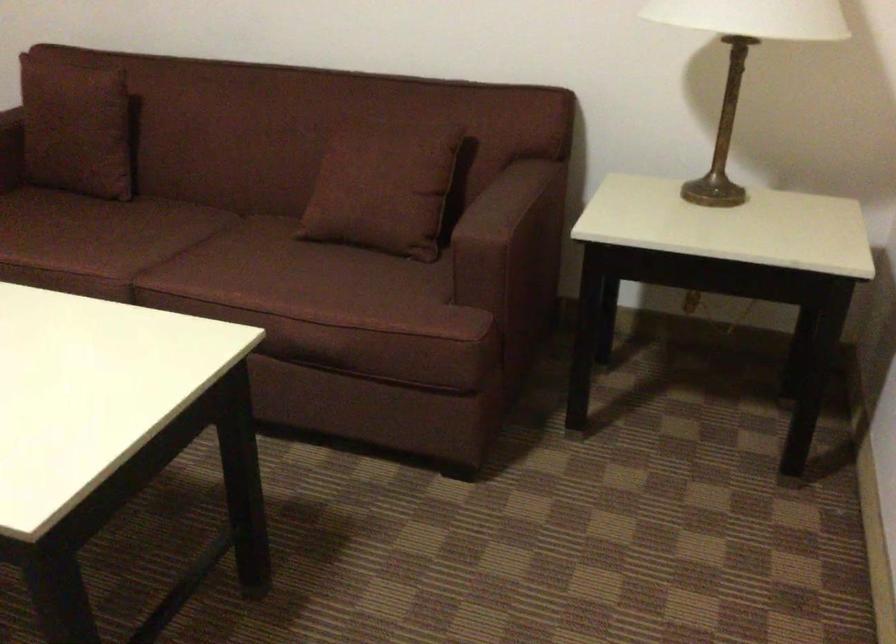
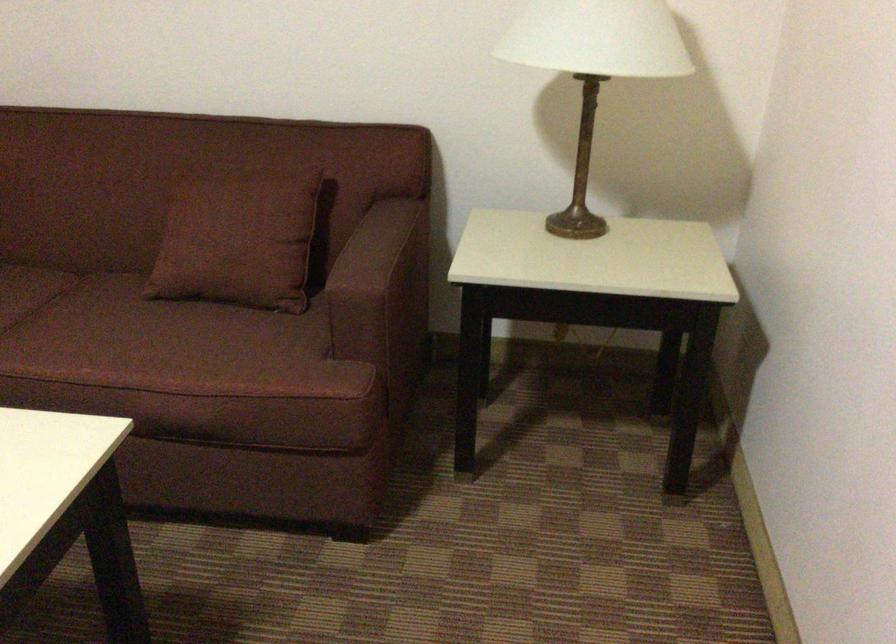
Where in the second image is the point corresponding to point (496, 207) from the first image?

(367, 254)